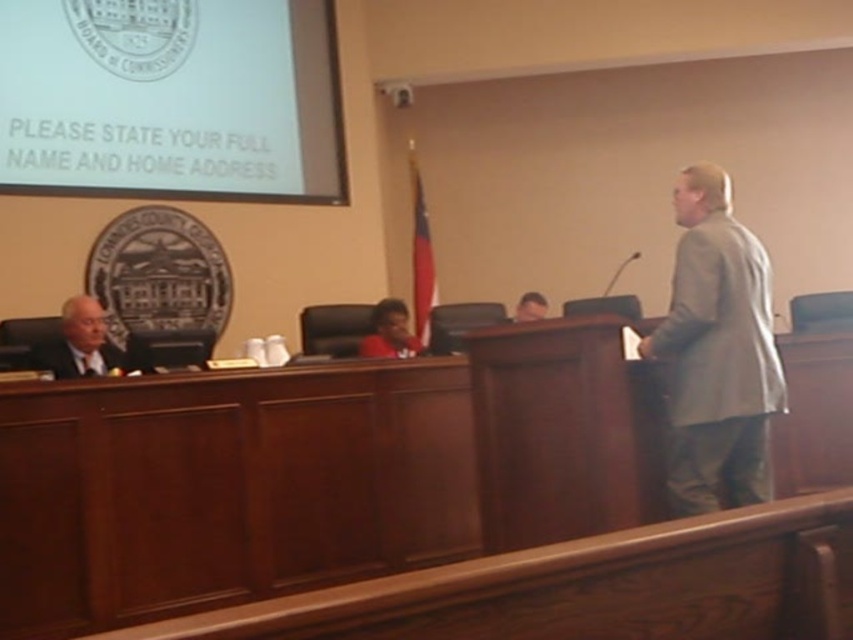
You are an interior designer assessing the courtroom layout. The gray fabric suit at right and the smooth gray suit at center are part of the decor. Which one has a greater width?

The gray fabric suit at right has a greater width than the smooth gray suit at center according to the description.

Based on the photo, you are an attendee at the meeting and want to locate the person wearing the gray fabric suit at right. Where should you look in the room?

The gray fabric suit at right is located at the 2D coordinates point (717, 353) in the room.

You are an event organizer who needs to seat two speakers in the front row of the courtroom. The gray fabric suit at right and the dark gray fabric business suit at left are currently seated. Which speaker should you move to the center seat if the front row has limited space?

You should move the dark gray fabric business suit at left to the center seat because it is smaller in size than the gray fabric suit at right, allowing better space utilization in the front row.